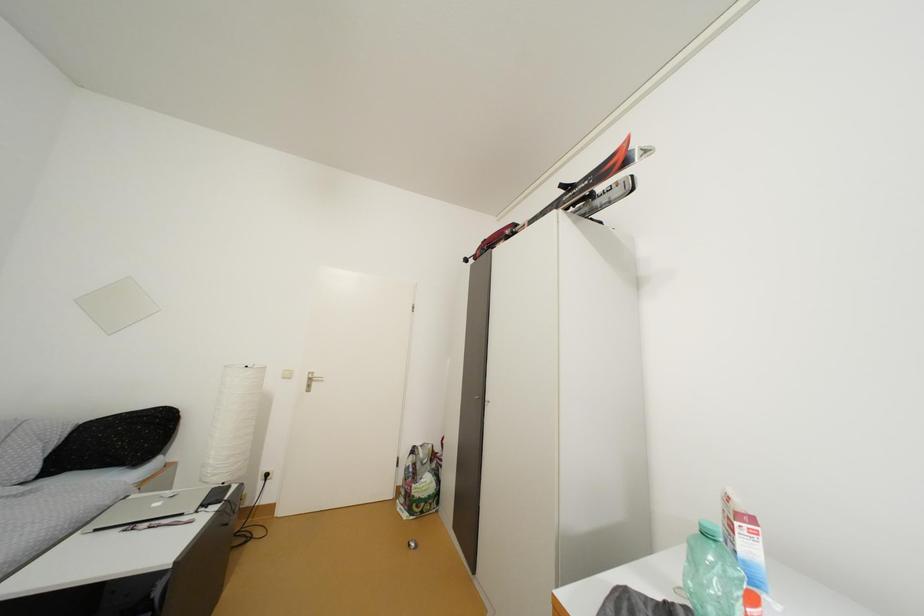
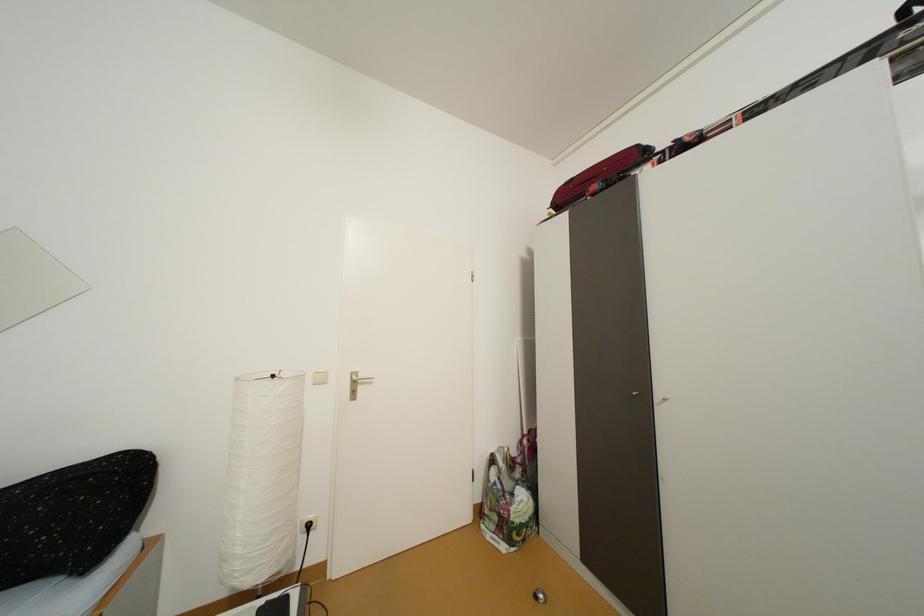
The images are taken continuously from a first-person perspective. In which direction are you moving?

The movement direction of the cameraman is left, forward.